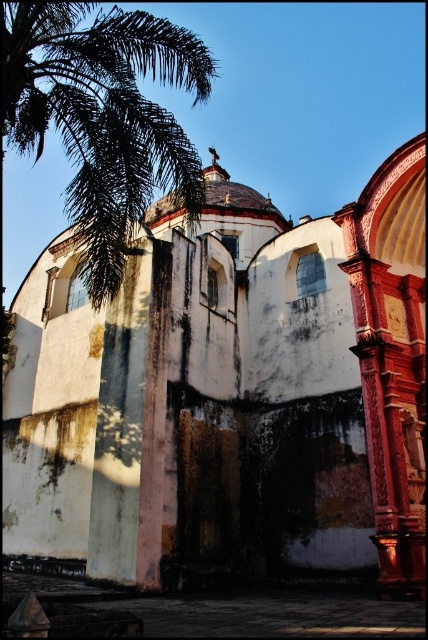
Can you confirm if white weathered stone church at center is taller than green leafy palm at upper left?

In fact, white weathered stone church at center may be shorter than green leafy palm at upper left.

Image resolution: width=428 pixels, height=640 pixels. Describe the element at coordinates (228, 396) in the screenshot. I see `white weathered stone church at center` at that location.

Between point (74, 454) and point (35, 92), which one is positioned behind?

The point (74, 454) is behind.

Where is `white weathered stone church at center`? The width and height of the screenshot is (428, 640). white weathered stone church at center is located at coordinates (228, 396).